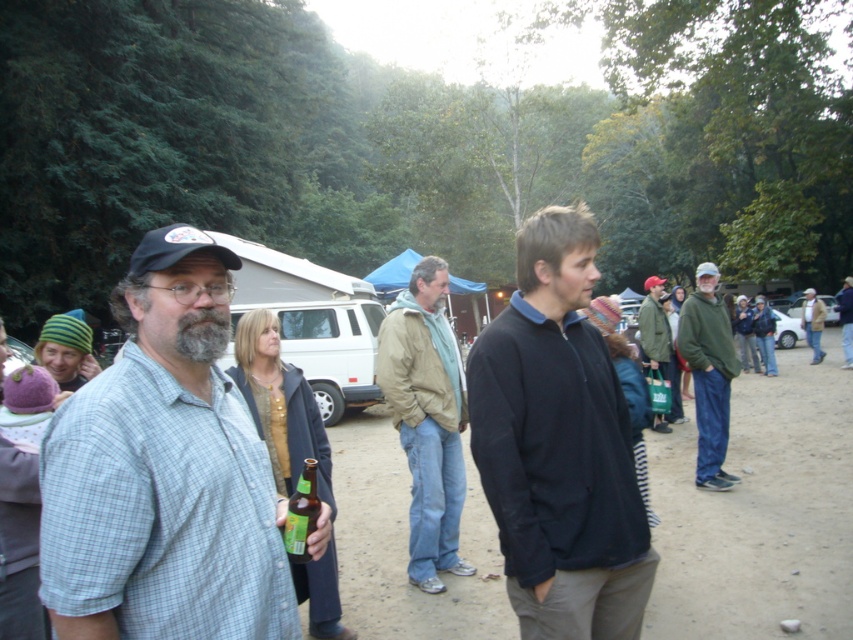
You are standing at the point marked as point (164, 472) in the image. What object are you currently standing on?

The point (164, 472) is on the light blue plaid shirt at center, so you are standing on the light blue plaid shirt at center.

You are organizing a group photo and need to arrange the two jackets, light brown jacket at center and green fabric jacket at center, on a shelf. Which jacket should you place on the lower shelf to ensure they are displayed properly?

The light brown jacket at center should be placed on the lower shelf because it is smaller than the green fabric jacket at center, allowing for proper display.

You are organizing a group photo and need to ensure everyone fits in the frame. The light blue plaid shirt at center and the light brown jacket at center are both in the center area. Which person should move closer to the camera to ensure both fit comfortably in the photo?

The light blue plaid shirt at center should move closer to the camera because it occupies less space than the light brown jacket at center, allowing both to fit better in the frame.